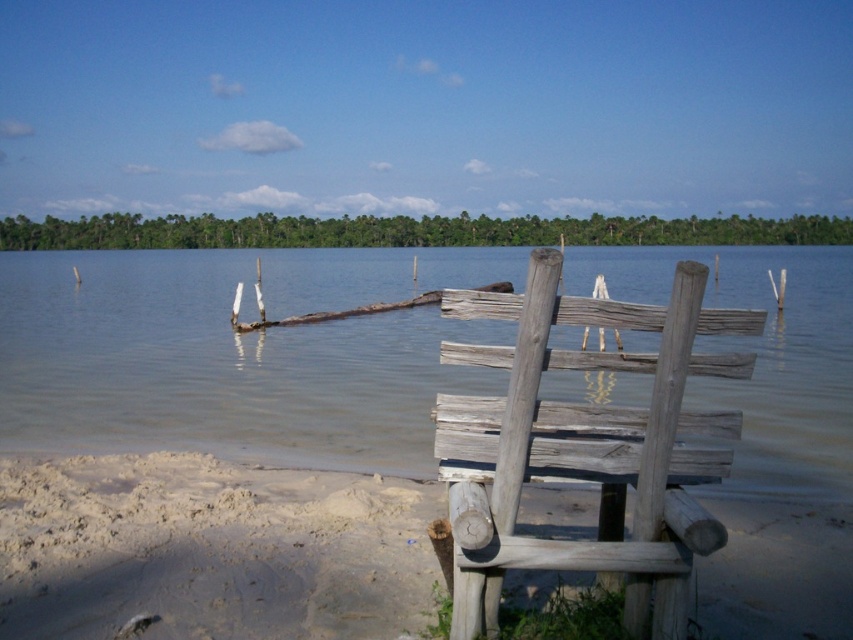
Question: Which of the following is the farthest from the observer?

Choices:
 (A) light brown sandy beach at lower left
 (B) clear water at chair right
 (C) weathered wood chair at center

Answer: (A)

Question: Can you confirm if clear water at chair right is positioned to the right of light brown sandy beach at lower left?

Choices:
 (A) no
 (B) yes

Answer: (B)

Question: Which point is closer to the camera taking this photo?

Choices:
 (A) (830, 577)
 (B) (578, 285)

Answer: (A)

Question: Which point is closer to the camera?

Choices:
 (A) light brown sandy beach at lower left
 (B) clear water at chair right

Answer: (B)

Question: Does clear water at chair right have a larger size compared to weathered wood chair at center?

Choices:
 (A) no
 (B) yes

Answer: (B)

Question: Does light brown sandy beach at lower left come behind weathered wood chair at center?

Choices:
 (A) yes
 (B) no

Answer: (A)